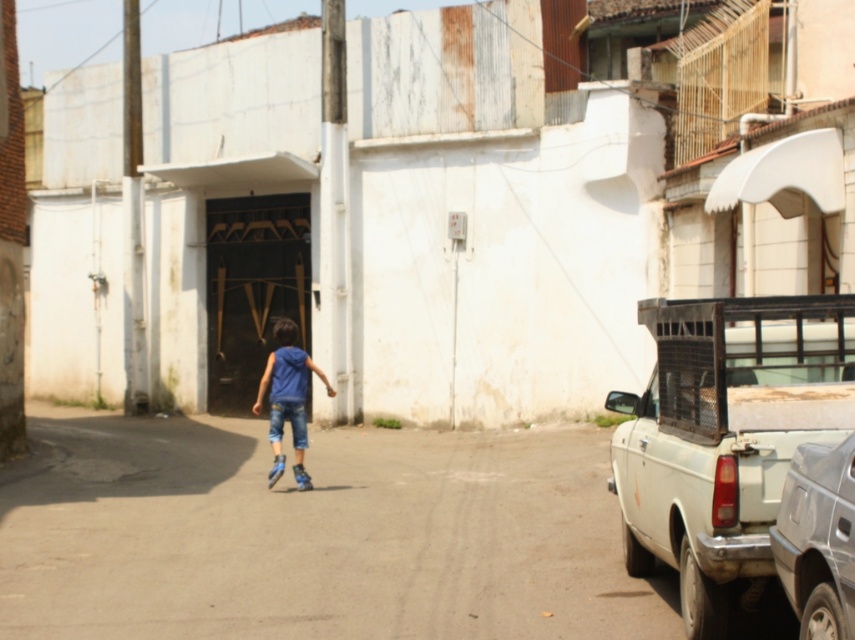
Question: Can you confirm if silver metallic car at right is thinner than blue denim jeans at center?

Choices:
 (A) no
 (B) yes

Answer: (B)

Question: Which point is farther to the camera?

Choices:
 (A) (848, 500)
 (B) (793, 314)
 (C) (276, 380)
 (D) (292, 428)

Answer: (D)

Question: Which point is farther to the camera?

Choices:
 (A) white matte pickup truck at right
 (B) silver metallic car at right
 (C) blue denim jeans at center
 (D) denim at center

Answer: (C)

Question: Is blue denim jeans at center above denim at center?

Choices:
 (A) no
 (B) yes

Answer: (B)

Question: Does silver metallic car at right appear over denim at center?

Choices:
 (A) yes
 (B) no

Answer: (A)

Question: Which object is farther from the camera taking this photo?

Choices:
 (A) blue denim jeans at center
 (B) denim at center
 (C) silver metallic car at right
 (D) white matte pickup truck at right

Answer: (A)